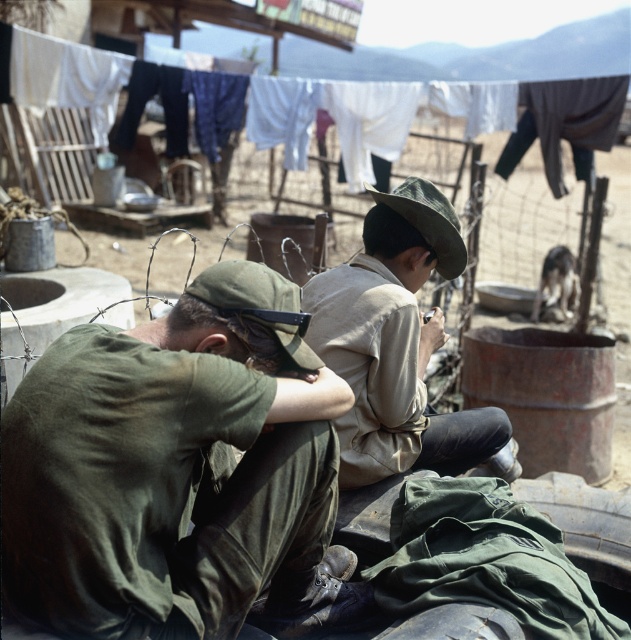
Is green matte uniform at center wider than khaki fabric hat at center?

Yes, green matte uniform at center is wider than khaki fabric hat at center.

Is green matte uniform at center to the left of khaki fabric hat at center from the viewer's perspective?

Yes, green matte uniform at center is to the left of khaki fabric hat at center.

Find the location of a particular element. This screenshot has height=640, width=631. green matte uniform at center is located at coordinates (172, 467).

Is green matte uniform at center behind white cotton clothes at upper center?

No, green matte uniform at center is in front of white cotton clothes at upper center.

Between green matte uniform at center and white cotton clothes at upper center, which one has less height?

With less height is green matte uniform at center.

The image size is (631, 640). What are the coordinates of `green matte uniform at center` in the screenshot? It's located at (172, 467).

Where is `green matte uniform at center`? The image size is (631, 640). green matte uniform at center is located at coordinates (172, 467).

Measure the distance between point [374,356] and camera.

Point [374,356] is 3.20 meters away from camera.

Is khaki fabric hat at center taller than white cotton clothes at upper center?

Incorrect, khaki fabric hat at center's height is not larger of white cotton clothes at upper center's.

At what (x,y) coordinates should I click in order to perform the action: click on khaki fabric hat at center. Please return your answer as a coordinate pair (x, y). Image resolution: width=631 pixels, height=640 pixels. Looking at the image, I should click on (396, 342).

This screenshot has height=640, width=631. In order to click on khaki fabric hat at center in this screenshot , I will do `click(396, 342)`.